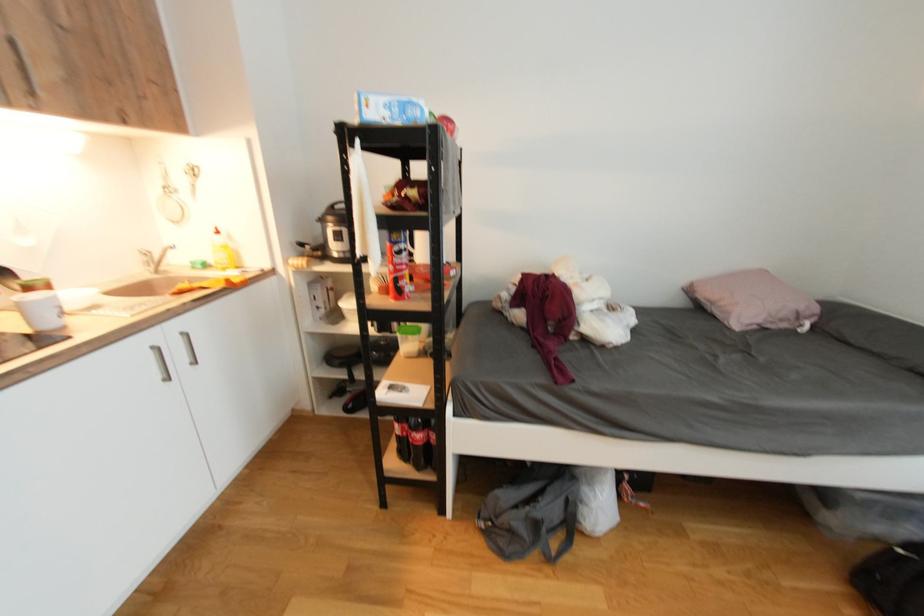
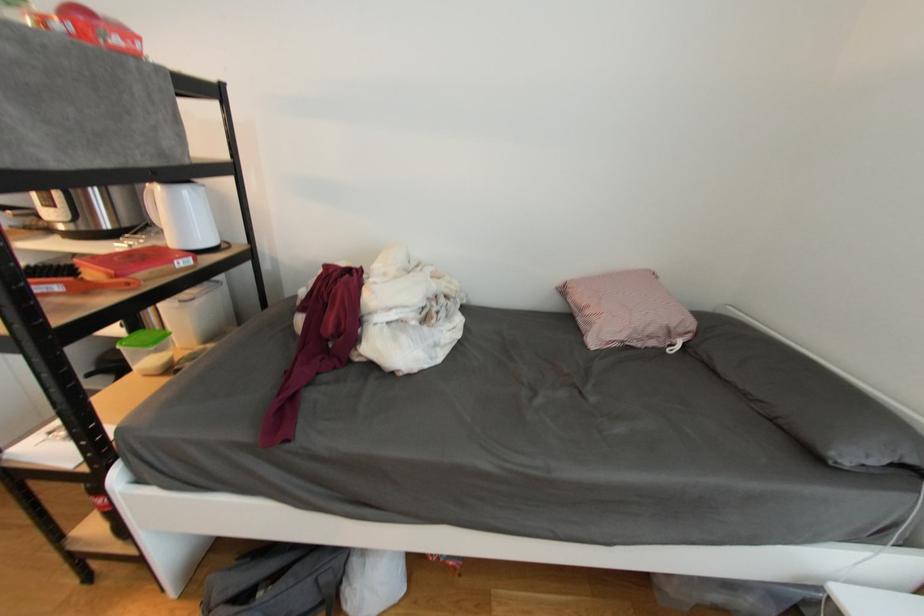
Question: The images are taken continuously from a first-person perspective. In which direction is your viewpoint rotating?

Choices:
 (A) Left
 (B) Right
 (C) Up
 (D) Down

Answer: (B)